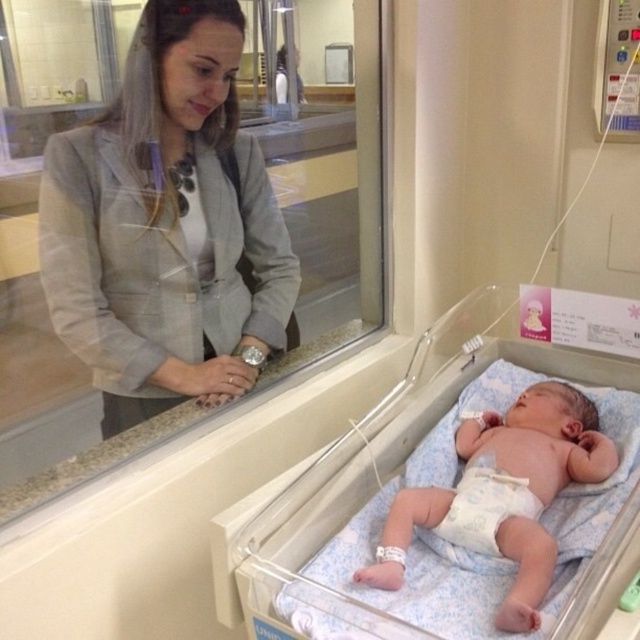
You are a nurse in the hospital and need to check the diaper of the light blue diapered baby at lower right and the white cloth diaper at center. Which one requires a larger change pad based on their size?

The light blue diapered baby at lower right is taller than the white cloth diaper at center, so it requires a larger change pad.

You are a nurse in the hospital and need to place a medical chart on the white fabric hospital bed at lower center. However, there is a gray textured blazer at upper left currently covering part of it. Can you place the chart on the bed without moving the blazer?

The gray textured blazer at upper left is positioned over the white fabric hospital bed at lower center, so placing the chart directly on the bed without moving the blazer may be difficult as the blazer is covering part of the bed.

You are a healthcare worker needing to measure the distance between the light blue diapered baby at lower right and the camera. What is the exact distance?

The exact distance of the light blue diapered baby at lower right from the camera is 37.45 inches.